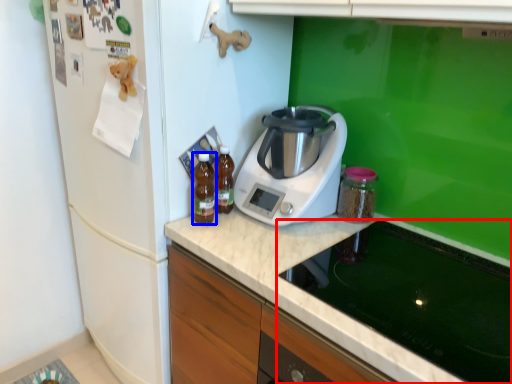
Question: Which of the following is the farthest to the observer, home appliance (highlighted by a red box) or kitchen appliance (highlighted by a blue box)?

Choices:
 (A) home appliance
 (B) kitchen appliance

Answer: (B)